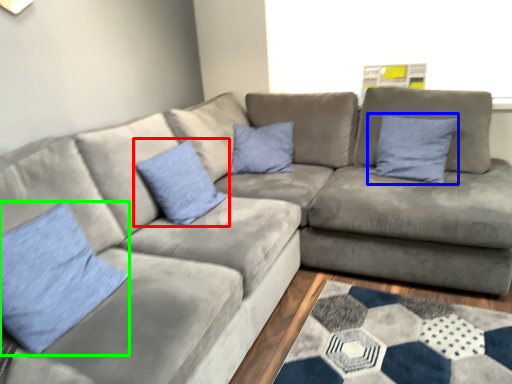
Question: Which object is positioned farthest from pillow (highlighted by a red box)? Select from pillow (highlighted by a blue box) and pillow (highlighted by a green box).

Choices:
 (A) pillow
 (B) pillow

Answer: (A)